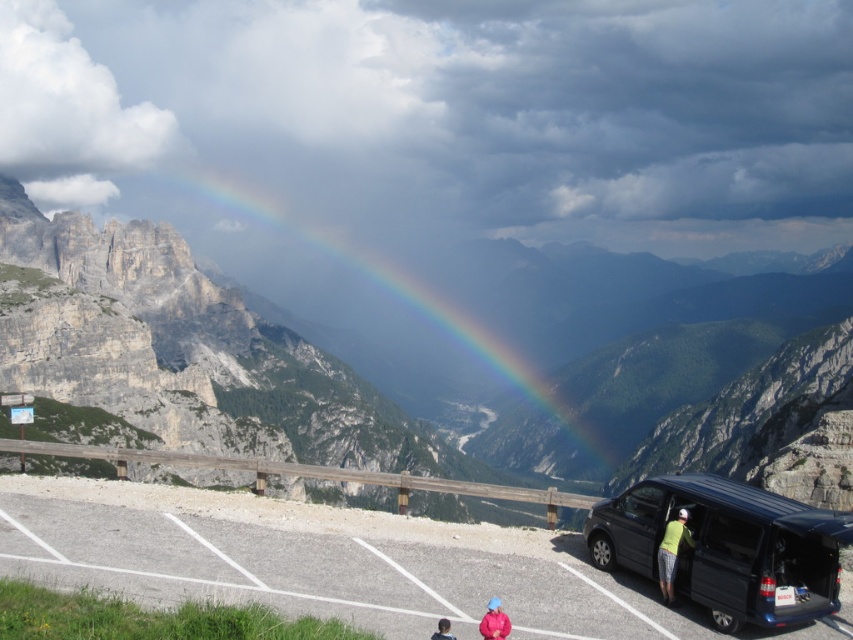
Question: Which point is farther to the camera?

Choices:
 (A) (61, 573)
 (B) (534, 440)
 (C) (787, 602)
 (D) (677, 544)

Answer: (B)

Question: Based on their relative distances, which object is nearer to the dark gray asphalt parking lot at lower center?

Choices:
 (A) rainbow at upper center
 (B) green fabric jacket at lower right

Answer: (B)

Question: Where is pink fabric jacket at lower center located in relation to smooth blue shirt at lower center in the image?

Choices:
 (A) right
 (B) left

Answer: (A)

Question: Is dark gray asphalt parking lot at lower center positioned behind smooth blue shirt at lower center?

Choices:
 (A) no
 (B) yes

Answer: (B)

Question: Does dark gray asphalt parking lot at lower center come behind rainbow at upper center?

Choices:
 (A) no
 (B) yes

Answer: (A)

Question: Which object is positioned closest to the smooth blue shirt at lower center?

Choices:
 (A) matte black van at lower right
 (B) green fabric jacket at lower right

Answer: (B)